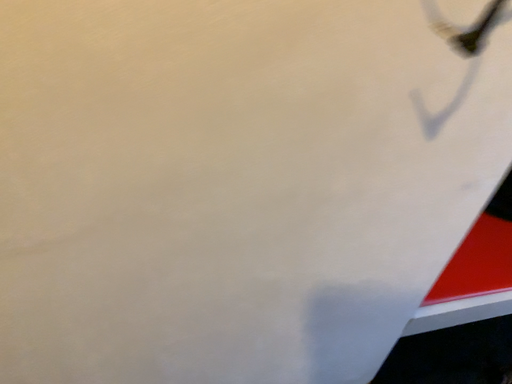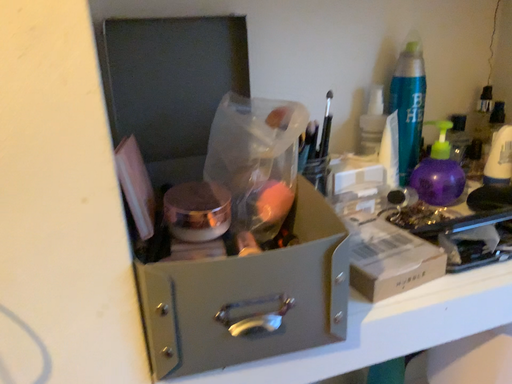
Question: How did the camera likely rotate when shooting the video?

Choices:
 (A) rotated downward
 (B) rotated upward

Answer: (B)